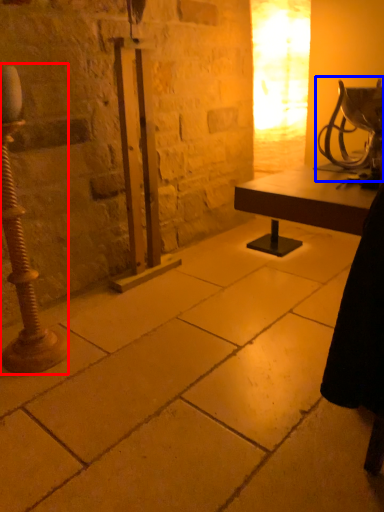
Question: Which of the following is the closest to the observer, pillar (highlighted by a red box) or table lamp (highlighted by a blue box)?

Choices:
 (A) pillar
 (B) table lamp

Answer: (B)